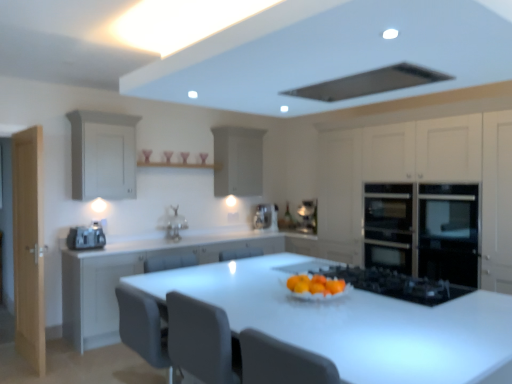
What do you see at coordinates (130, 275) in the screenshot?
I see `white matte cabinet at center, which ranks as the third cabinetry in right-to-left order` at bounding box center [130, 275].

How much space does white matte cabinet at center, which ranks as the third cabinetry in right-to-left order, occupy vertically?

white matte cabinet at center, which ranks as the third cabinetry in right-to-left order, is 39.10 inches tall.

From the picture: Measure the distance between point (x=226, y=183) and camera.

The depth of point (x=226, y=183) is 18.54 feet.

Describe the element at coordinates (175, 225) in the screenshot. The width and height of the screenshot is (512, 384). I see `matte silver sink at center` at that location.

In order to click on matte silver sink at center in this screenshot , I will do `click(175, 225)`.

You are a GUI agent. You are given a task and a screenshot of the screen. Output one action in this format:
    pyautogui.click(x=<x>, y=<y>)
    Task: Click on the black matte exhaust hood at upper center
    Image resolution: width=512 pixels, height=384 pixels.
    Given the screenshot: What is the action you would take?
    pyautogui.click(x=369, y=83)

What is the approximate width of black matte exhaust hood at upper center?

black matte exhaust hood at upper center is 19.99 inches in width.

In order to face black glass gas stove at center, should I rotate leftwards or rightwards?

Turn right approximately 16.476 degrees to face it.

Find the location of a particular element. white matte cabinet at center, which ranks as the third cabinetry in right-to-left order is located at coordinates (130, 275).

Does black matte exhaust hood at upper center turn towards satin silver toaster at left?

No, black matte exhaust hood at upper center does not turn towards satin silver toaster at left.

Does black matte exhaust hood at upper center have a greater height compared to satin silver toaster at left?

Incorrect, the height of black matte exhaust hood at upper center is not larger of that of satin silver toaster at left.

Is black matte exhaust hood at upper center touching satin silver toaster at left?

No, black matte exhaust hood at upper center is not with satin silver toaster at left.

Is black glass gas stove at center far away from matte silver sink at center?

black glass gas stove at center is positioned a significant distance from matte silver sink at center.

Can you tell me how much black glass gas stove at center and matte silver sink at center differ in facing direction?

The angular difference between black glass gas stove at center and matte silver sink at center is 89.8 degrees.

From the image's perspective, would you say black glass gas stove at center is shown under matte silver sink at center?

Yes, from the image's perspective, black glass gas stove at center is below matte silver sink at center.

Between black glass gas stove at center and matte silver sink at center, which one has larger width?

With larger width is black glass gas stove at center.

Which object is further away from the camera taking this photo, white glossy table at center or satin silver coffee machine at center?

satin silver coffee machine at center.

How much distance is there between white glossy table at center and satin silver coffee machine at center?

white glossy table at center is 9.73 feet from satin silver coffee machine at center.

From the image's perspective, which one is positioned lower, white glossy table at center or satin silver coffee machine at center?

white glossy table at center.

Is white glossy table at center to the left of satin silver coffee machine at center from the viewer's perspective?

No.

Does black glass oven at right, the 1th cabinetry positioned from the right, have a lesser height compared to black matte exhaust hood at upper center?

No.

Is black glass oven at right, the 1th cabinetry positioned from the right, oriented away from black matte exhaust hood at upper center?

No, black glass oven at right, the 1th cabinetry positioned from the right, is not facing the opposite direction of black matte exhaust hood at upper center.

Is black glass oven at right, the 1th cabinetry positioned from the right, not within black matte exhaust hood at upper center?

Yes.

Looking at this image, from the image's perspective, who appears lower, black glass oven at right, which ranks as the 4th cabinetry in left-to-right order, or black matte exhaust hood at upper center?

black glass oven at right, which ranks as the 4th cabinetry in left-to-right order, appears lower in the image.

Which of these two, matte silver sink at center or matte white cabinet at left, the 1th cabinetry viewed from the left, is wider?

matte white cabinet at left, the 1th cabinetry viewed from the left.

Is matte silver sink at center spatially inside matte white cabinet at left, arranged as the 4th cabinetry when viewed from the right, or outside of it?

matte silver sink at center is located beyond the bounds of matte white cabinet at left, arranged as the 4th cabinetry when viewed from the right.

Does matte silver sink at center have a smaller size compared to matte white cabinet at left, arranged as the 4th cabinetry when viewed from the right?

Correct, matte silver sink at center occupies less space than matte white cabinet at left, arranged as the 4th cabinetry when viewed from the right.

Considering the relative positions of matte silver sink at center and matte white cabinet at left, the 1th cabinetry viewed from the left, in the image provided, is matte silver sink at center to the left or to the right of matte white cabinet at left, the 1th cabinetry viewed from the left,?

Clearly, matte silver sink at center is on the right of matte white cabinet at left, the 1th cabinetry viewed from the left, in the image.

Are white matte cabinet at upper center, acting as the 2th cabinetry starting from the right, and matte silver sink at center far apart?

That's right, there is a large distance between white matte cabinet at upper center, acting as the 2th cabinetry starting from the right, and matte silver sink at center.

Considering the relative sizes of white matte cabinet at upper center, acting as the 2th cabinetry starting from the right, and matte silver sink at center in the image provided, is white matte cabinet at upper center, acting as the 2th cabinetry starting from the right, taller than matte silver sink at center?

Correct, white matte cabinet at upper center, acting as the 2th cabinetry starting from the right, is much taller as matte silver sink at center.

Which point is more distant from viewer, (224,167) or (182,228)?

The point (224,167) is behind.

Is satin silver coffee machine at center smaller than matte silver sink at center?

Correct, satin silver coffee machine at center occupies less space than matte silver sink at center.

In terms of height, does satin silver coffee machine at center look taller or shorter compared to matte silver sink at center?

Considering their sizes, satin silver coffee machine at center has less height than matte silver sink at center.

From the image's perspective, which object appears higher, satin silver coffee machine at center or matte silver sink at center?

matte silver sink at center.

Is matte silver sink at center at the back of satin silver coffee machine at center?

No, matte silver sink at center is not at the back of satin silver coffee machine at center.

Find the location of a particular element. The width and height of the screenshot is (512, 384). exhaust hood in front of the satin silver toaster at left is located at coordinates (369, 83).

Where is `gas stove on the right of matte silver sink at center`? This screenshot has width=512, height=384. gas stove on the right of matte silver sink at center is located at coordinates (387, 282).

Considering their positions, is white matte cabinet at upper center, acting as the 2th cabinetry starting from the right, positioned closer to satin silver coffee machine at center than white glossy table at center?

white matte cabinet at upper center, acting as the 2th cabinetry starting from the right.

Estimate the real-world distances between objects in this image. Which object is closer to black matte exhaust hood at upper center, black glass gas stove at center or black glass oven at right, which ranks as the 4th cabinetry in left-to-right order?

Based on the image, black glass gas stove at center appears to be nearer to black matte exhaust hood at upper center.

Estimate the real-world distances between objects in this image. Which object is further from white matte cabinet at upper center, placed as the third cabinetry when sorted from left to right, black glass gas stove at center or matte silver sink at center?

black glass gas stove at center.

Looking at the image, which one is located further to black stainless steel oven at right, matte silver sink at center or black glass gas stove at center?

matte silver sink at center.

Considering their positions, is black matte exhaust hood at upper center positioned further to black stainless steel oven at right than light wood door at left?

light wood door at left lies further to black stainless steel oven at right than the other object.

When comparing their distances from matte white cabinet at left, the 1th cabinetry viewed from the left, does black glass oven at right, the 1th cabinetry positioned from the right, or black stainless steel oven at right seem further?

The object further to matte white cabinet at left, the 1th cabinetry viewed from the left, is black stainless steel oven at right.

Looking at this image, from the image, which object appears to be nearer to satin silver coffee machine at center, white glossy table at center or black stainless steel oven at right?

black stainless steel oven at right.

Looking at the image, which one is located further to black stainless steel oven at right, satin silver coffee machine at center or white glossy table at center?

The object further to black stainless steel oven at right is satin silver coffee machine at center.

You are a GUI agent. You are given a task and a screenshot of the screen. Output one action in this format:
    pyautogui.click(x=<x>, y=<y>)
    Task: Click on the home appliance located between light wood door at left and black glass oven at right, the 1th cabinetry positioned from the right, in the left-right direction
    The width and height of the screenshot is (512, 384).
    Given the screenshot: What is the action you would take?
    pyautogui.click(x=86, y=237)

Where is `sink between satin silver toaster at left and black glass gas stove at center`? This screenshot has width=512, height=384. sink between satin silver toaster at left and black glass gas stove at center is located at coordinates (175, 225).

The height and width of the screenshot is (384, 512). Identify the location of oven between black matte exhaust hood at upper center and white matte cabinet at upper center, acting as the 2th cabinetry starting from the right, in the front-back direction. coord(424,230).

I want to click on home appliance located between white matte cabinet at center, which appears as the 2th cabinetry when viewed from the left, and satin silver coffee machine at center in the depth direction, so click(86, 237).